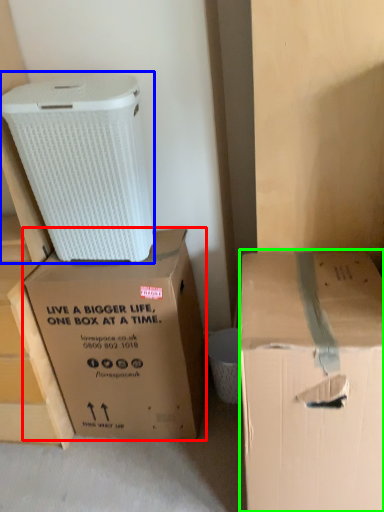
Question: Estimate the real-world distances between objects in this image. Which object is farther from box (highlighted by a red box), cardboard box (highlighted by a blue box) or box (highlighted by a green box)?

Choices:
 (A) cardboard box
 (B) box

Answer: (B)